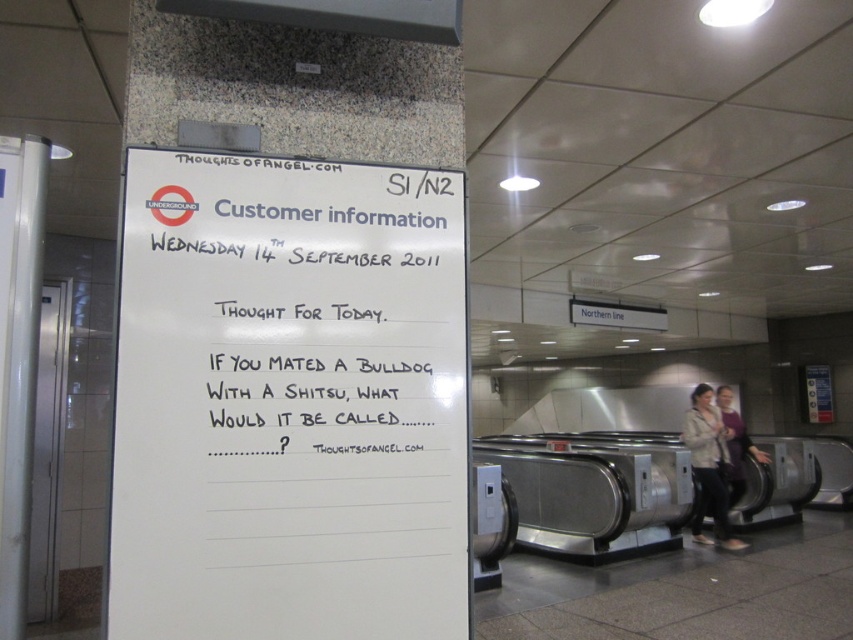
Does white paper at upper left have a greater height compared to light beige jacket at lower right?

No, white paper at upper left is not taller than light beige jacket at lower right.

This screenshot has width=853, height=640. In order to click on white paper at upper left in this screenshot , I will do `click(288, 401)`.

The width and height of the screenshot is (853, 640). I want to click on white paper at upper left, so click(288, 401).

Locate an element on the screen. white paper at upper left is located at coordinates (288, 401).